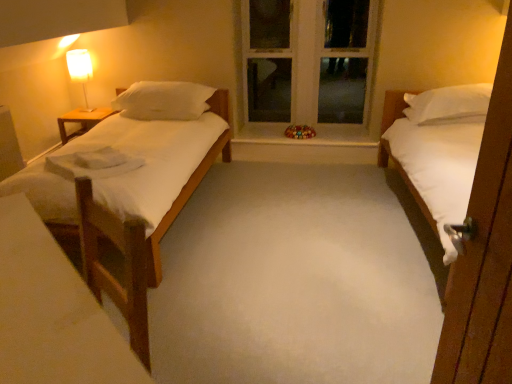
Question: Considering the positions of matte white lamp at upper left and wooden vanity at left in the image, is matte white lamp at upper left wider or thinner than wooden vanity at left?

Choices:
 (A) thin
 (B) wide

Answer: (A)

Question: Considering the positions of matte white lamp at upper left and wooden vanity at left in the image, is matte white lamp at upper left bigger or smaller than wooden vanity at left?

Choices:
 (A) big
 (B) small

Answer: (B)

Question: Which object is the closest to the white matte bed at right?

Choices:
 (A) matte white lamp at upper left
 (B) wooden table at left
 (C) smooth glass window sill at center
 (D) white soft pillow at left
 (E) wooden vanity at left

Answer: (C)

Question: Estimate the real-world distances between objects in this image. Which object is farther from the white matte bed at right?

Choices:
 (A) white soft pillow at left
 (B) matte white lamp at upper left
 (C) white wood window frame at center
 (D) smooth glass window sill at center
 (E) wooden vanity at left

Answer: (B)